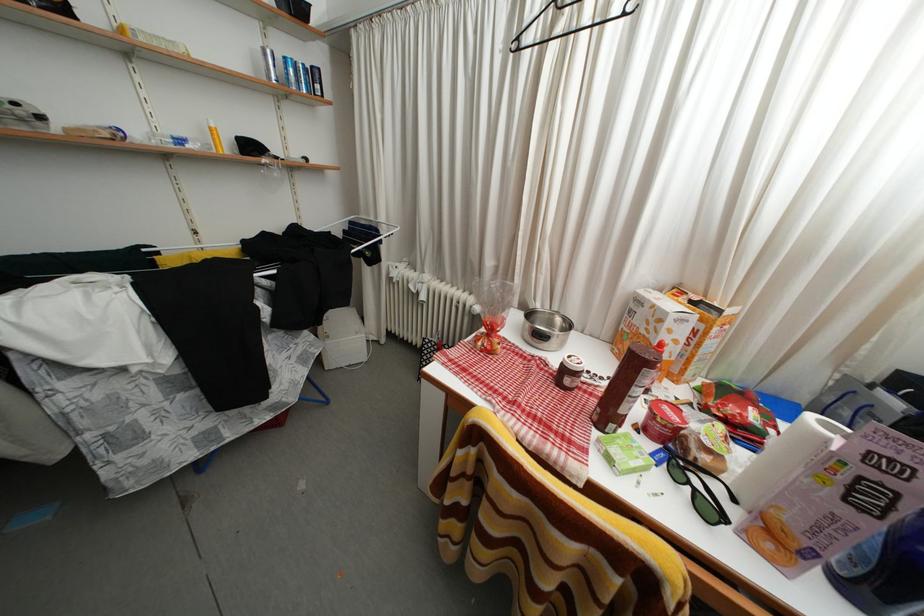
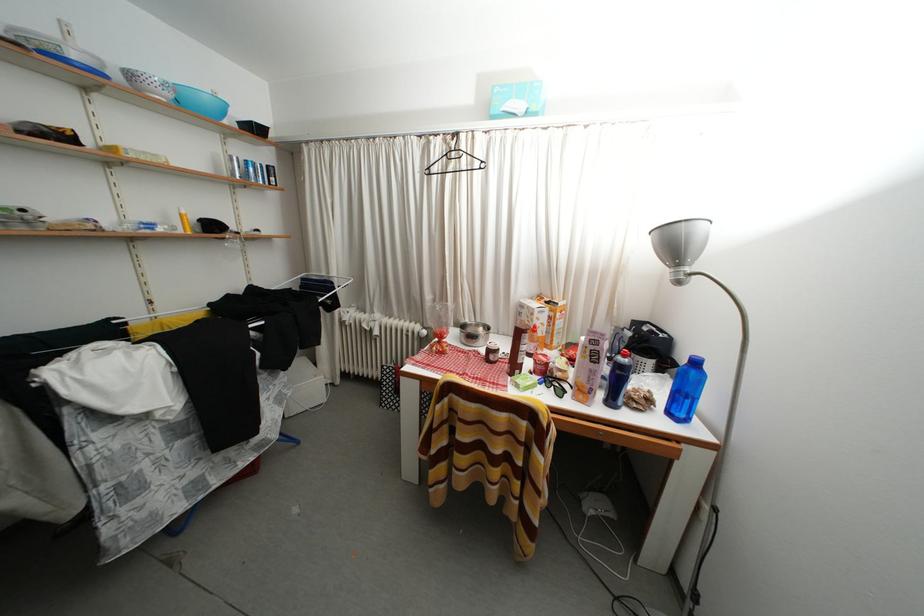
Locate, in the second image, the point that corresponds to point 573,376 in the first image.

(496, 357)